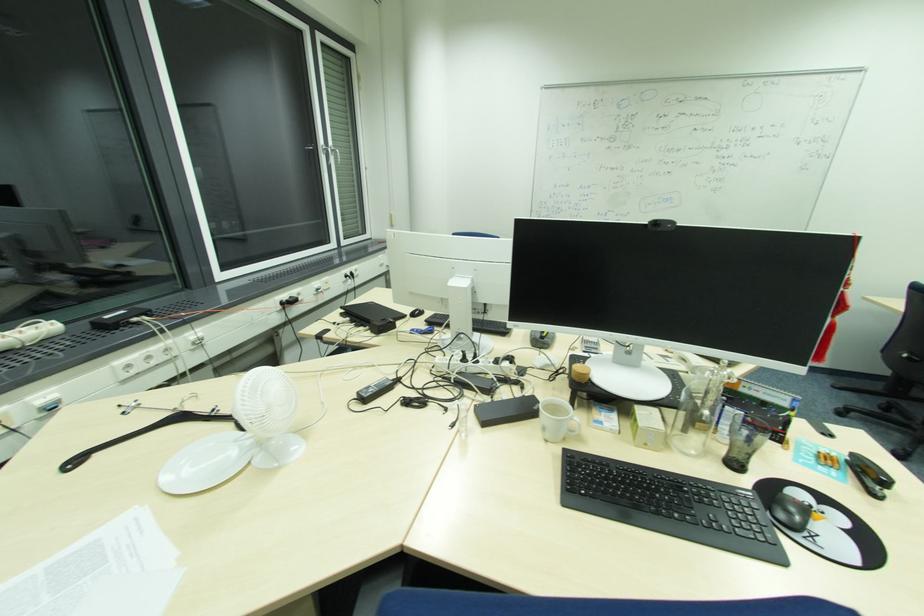
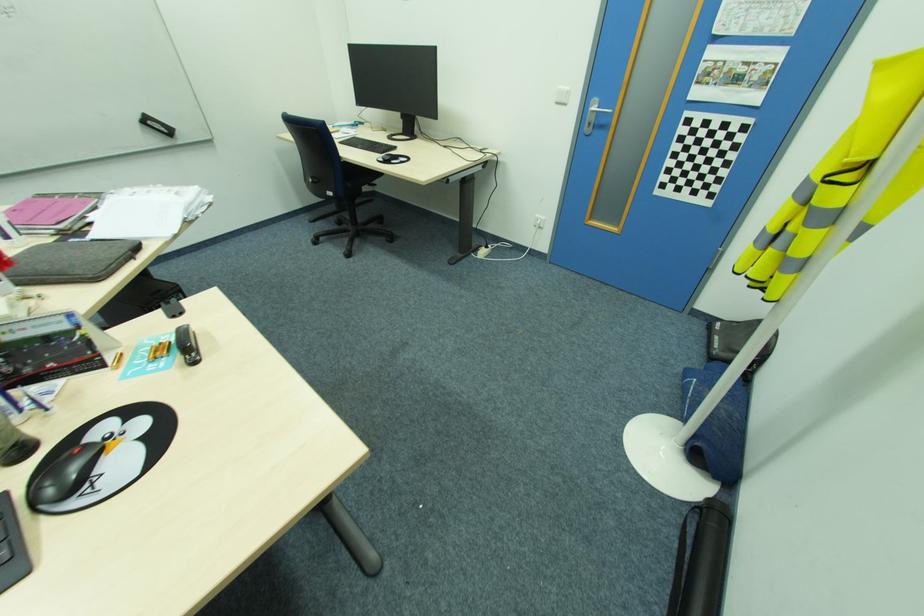
Locate, in the second image, the point that corresponds to (x=827, y=459) in the first image.

(164, 350)